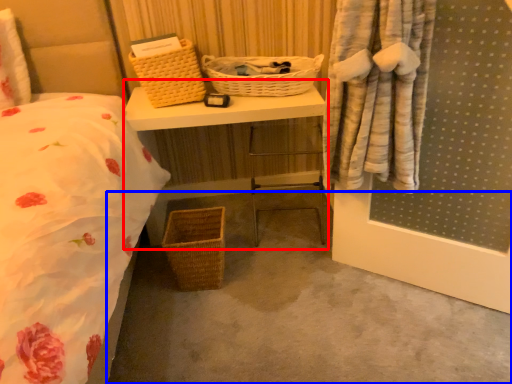
Question: Among these objects, which one is nearest to the camera, vanity (highlighted by a red box) or concrete (highlighted by a blue box)?

Choices:
 (A) vanity
 (B) concrete

Answer: (B)